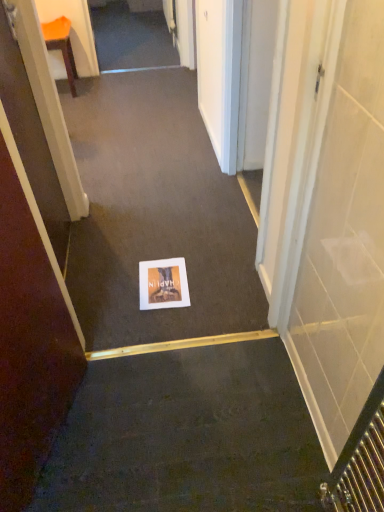
Question: Would you say matte paper postcard at center is part of brown matte door at lower left's contents?

Choices:
 (A) no
 (B) yes

Answer: (A)

Question: From the image's perspective, is brown matte door at lower left located above matte paper postcard at center?

Choices:
 (A) yes
 (B) no

Answer: (B)

Question: Considering the relative positions of brown matte door at lower left and matte paper postcard at center in the image provided, is brown matte door at lower left to the right of matte paper postcard at center from the viewer's perspective?

Choices:
 (A) no
 (B) yes

Answer: (A)

Question: Does brown matte door at lower left have a larger size compared to matte paper postcard at center?

Choices:
 (A) no
 (B) yes

Answer: (B)

Question: Is brown matte door at lower left facing towards matte paper postcard at center?

Choices:
 (A) yes
 (B) no

Answer: (B)

Question: Considering the relative positions of brown matte door at lower left and matte paper postcard at center in the image provided, is brown matte door at lower left to the left of matte paper postcard at center from the viewer's perspective?

Choices:
 (A) yes
 (B) no

Answer: (A)

Question: From a real-world perspective, is orange plastic chair at upper left physically below matte paper postcard at center?

Choices:
 (A) no
 (B) yes

Answer: (A)

Question: From the image's perspective, is orange plastic chair at upper left under matte paper postcard at center?

Choices:
 (A) no
 (B) yes

Answer: (A)

Question: Does orange plastic chair at upper left have a larger size compared to matte paper postcard at center?

Choices:
 (A) no
 (B) yes

Answer: (B)

Question: Is there a large distance between orange plastic chair at upper left and matte paper postcard at center?

Choices:
 (A) yes
 (B) no

Answer: (A)

Question: Is orange plastic chair at upper left looking in the opposite direction of matte paper postcard at center?

Choices:
 (A) no
 (B) yes

Answer: (A)

Question: Considering the relative sizes of orange plastic chair at upper left and matte paper postcard at center in the image provided, is orange plastic chair at upper left shorter than matte paper postcard at center?

Choices:
 (A) no
 (B) yes

Answer: (A)

Question: From the image's perspective, is white paper at center located above orange plastic chair at upper left?

Choices:
 (A) no
 (B) yes

Answer: (A)